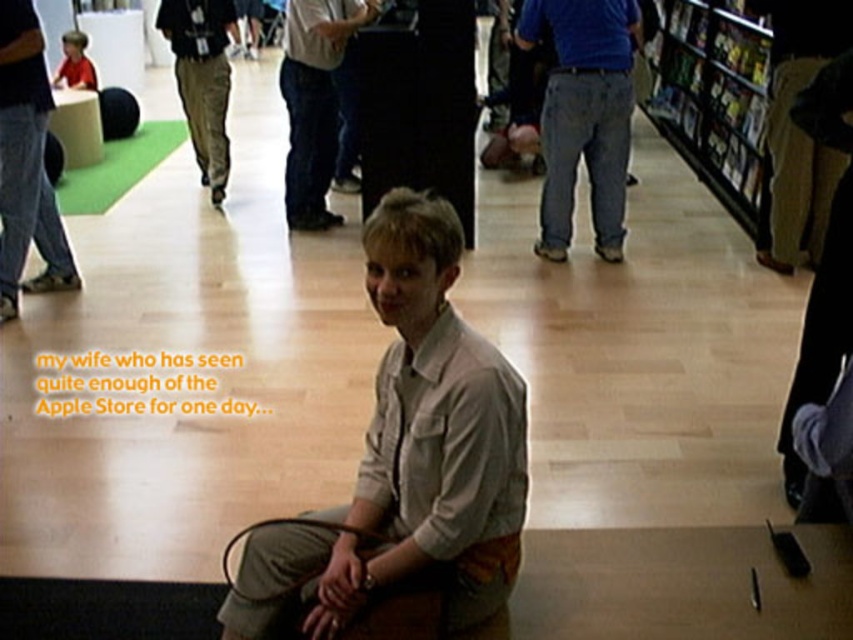
Question: Which object is farther from the camera taking this photo?

Choices:
 (A) denim pants at left
 (B) khaki pants at center
 (C) light beige shirt at center

Answer: (B)

Question: Estimate the real-world distances between objects in this image. Which object is farther from the khaki pants at center?

Choices:
 (A) matte red shirt at upper left
 (B) light beige shirt at center
 (C) khaki pants at right

Answer: (B)

Question: Considering the relative positions of light beige shirt at center and matte red shirt at upper left in the image provided, where is light beige shirt at center located with respect to matte red shirt at upper left?

Choices:
 (A) above
 (B) below

Answer: (B)

Question: Which is farther from the light gray shirt at center?

Choices:
 (A) matte red shirt at upper left
 (B) light beige shirt at center
 (C) khaki pants at center
 (D) denim pants at left

Answer: (B)

Question: Does light beige shirt at center come in front of matte red shirt at upper left?

Choices:
 (A) yes
 (B) no

Answer: (A)

Question: Does denim jeans at center appear on the left side of khaki pants at center?

Choices:
 (A) no
 (B) yes

Answer: (A)